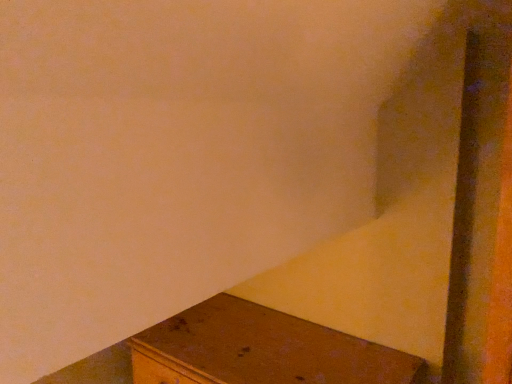
Find the location of a particular element. empty space that is ontop of wooden chest at lower left (from a real-world perspective) is located at coordinates (259, 348).